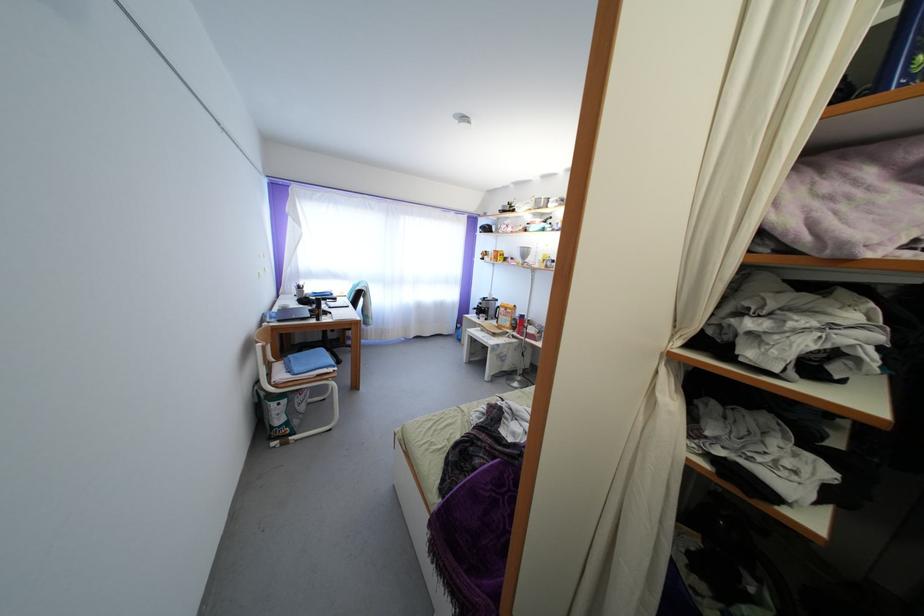
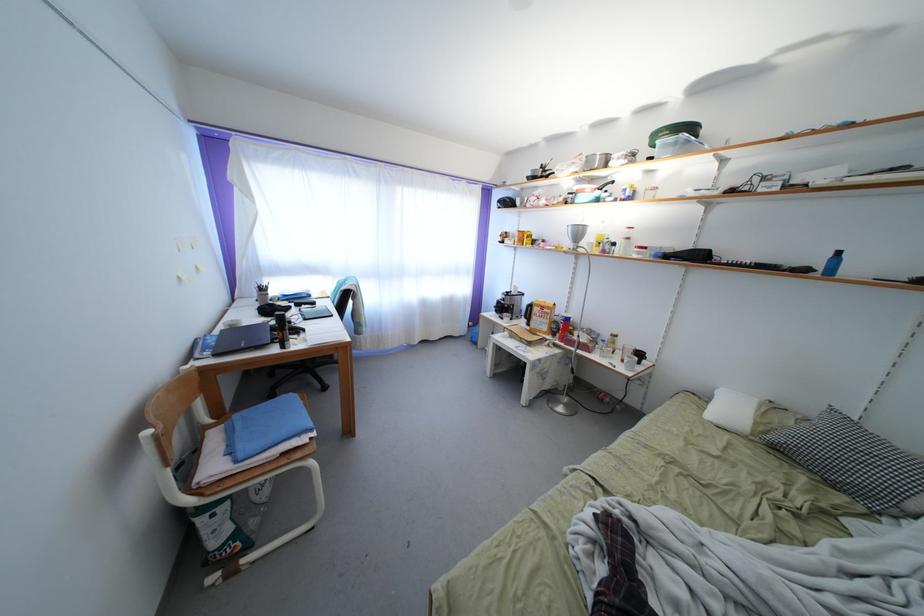
Locate, in the second image, the point that corresponds to (x=542, y=207) in the first image.

(594, 166)